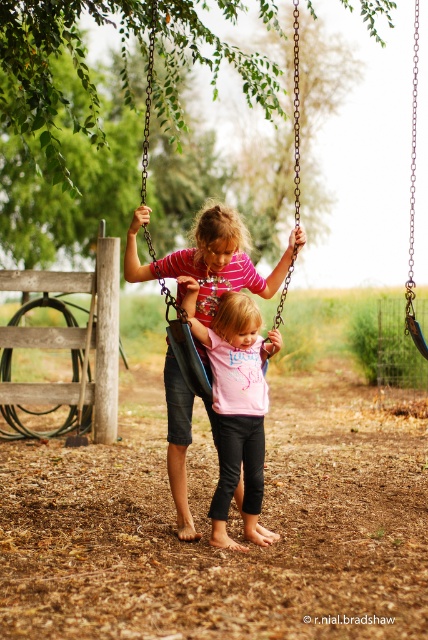
Can you confirm if pink matte shirt at center is taller than black plastic swing at center?

No, pink matte shirt at center is not taller than black plastic swing at center.

Does pink matte shirt at center have a lesser height compared to black plastic swing at center?

Yes, pink matte shirt at center is shorter than black plastic swing at center.

Looking at this image, who is more forward, (237,472) or (152,257)?

Point (237,472) is in front.

Find the location of `pink matte shirt at center`. pink matte shirt at center is located at coordinates (237, 403).

Who is shorter, matte pink shirt at center or pink matte shirt at center?

pink matte shirt at center is shorter.

Who is positioned more to the left, matte pink shirt at center or pink matte shirt at center?

From the viewer's perspective, matte pink shirt at center appears more on the left side.

Locate an element on the screen. This screenshot has width=428, height=640. matte pink shirt at center is located at coordinates (223, 259).

Image resolution: width=428 pixels, height=640 pixels. Find the location of `matte pink shirt at center`. matte pink shirt at center is located at coordinates (223, 259).

Does matte pink shirt at center have a greater width compared to black plastic swing at center?

Incorrect, matte pink shirt at center's width does not surpass black plastic swing at center's.

Which is in front, point (196, 269) or point (297, 186)?

Positioned in front is point (196, 269).

In order to click on matte pink shirt at center in this screenshot , I will do `click(223, 259)`.